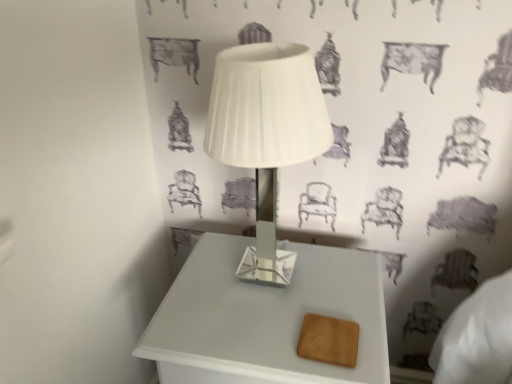
In order to click on blank space situated above white glossy table at center (from a real-world perspective) in this screenshot , I will do `click(280, 298)`.